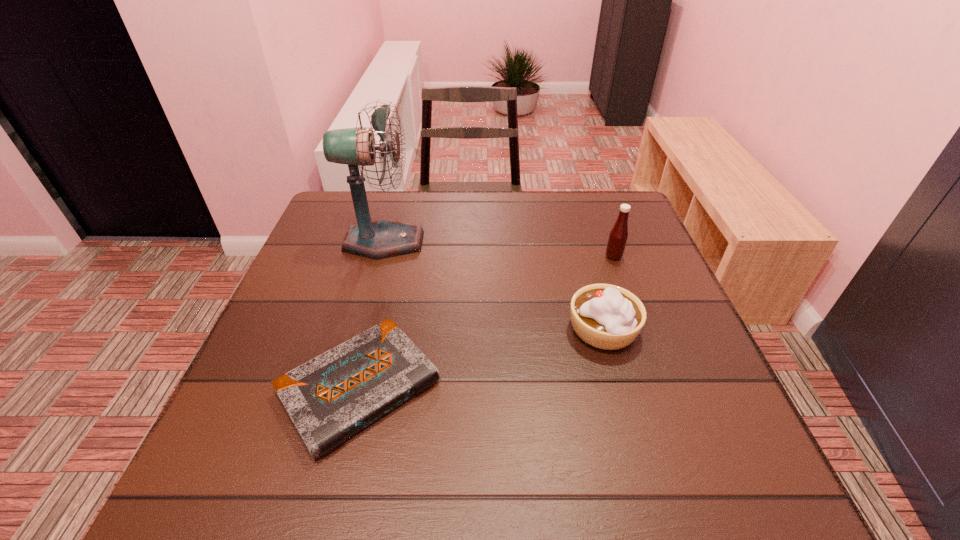
The image size is (960, 540). I want to click on vacant area between the whipped cream and the fan, so click(x=493, y=285).

The height and width of the screenshot is (540, 960). I want to click on vacant point located between the fan and the notebook, so 372,314.

Locate an element on the screen. Image resolution: width=960 pixels, height=540 pixels. empty space that is in between the shortest object and the whipped cream is located at coordinates (481, 358).

What are the coordinates of `object identified as the closest to the fan` in the screenshot? It's located at (330, 398).

This screenshot has width=960, height=540. I want to click on object that is the third nearest to the whipped cream, so click(x=383, y=238).

Locate an element on the screen. The height and width of the screenshot is (540, 960). vacant space that satisfies the following two spatial constraints: 1. in front of the tallest object where the wind blows; 2. on the right side of the whipped cream is located at coordinates (360, 329).

Identify the location of free space that satisfies the following two spatial constraints: 1. in front of the fan where the wind blows; 2. on the right side of the Tabasco sauce. (380, 256).

Find the location of a particular element. blank area in the image that satisfies the following two spatial constraints: 1. in front of the shortest object where the wind blows; 2. on the right side of the tallest object is located at coordinates (344, 387).

Identify the location of blank space that satisfies the following two spatial constraints: 1. on the back side of the whipped cream; 2. on the left side of the Tabasco sauce. The image size is (960, 540). (583, 256).

At what (x,y) coordinates should I click in order to perform the action: click on vacant space that satisfies the following two spatial constraints: 1. in front of the tallest object where the wind blows; 2. on the back side of the third shortest object. Please return your answer as a coordinate pair (x, y). The width and height of the screenshot is (960, 540). Looking at the image, I should click on (380, 256).